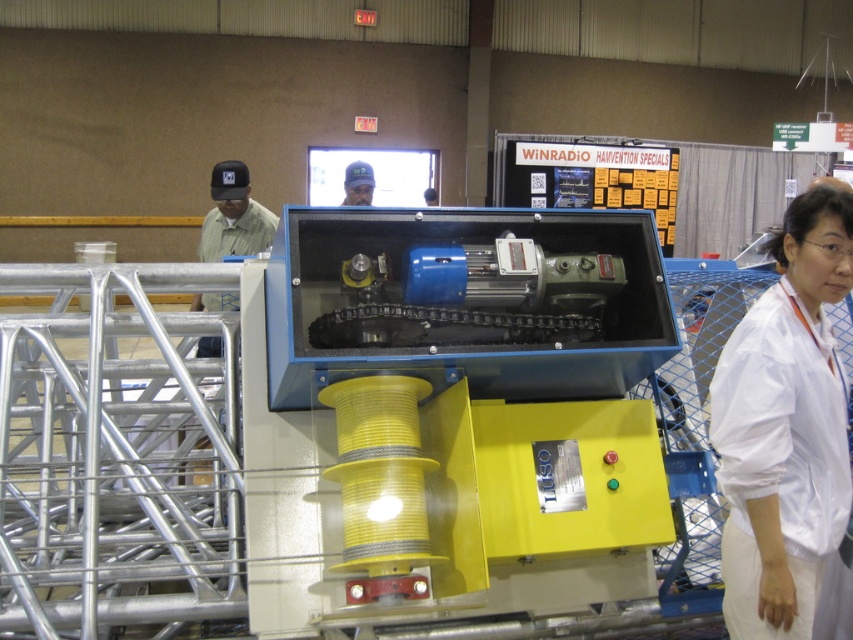
Question: Which object appears closest to the camera in this image?

Choices:
 (A) white fabric at right
 (B) matte green shirt at left
 (C) blue fabric cap at upper center

Answer: (A)

Question: Does white fabric at right appear over matte green shirt at left?

Choices:
 (A) no
 (B) yes

Answer: (A)

Question: Based on their relative distances, which object is nearer to the white fabric at right?

Choices:
 (A) blue fabric cap at upper center
 (B) matte green shirt at left

Answer: (B)

Question: Estimate the real-world distances between objects in this image. Which object is closer to the blue fabric cap at upper center?

Choices:
 (A) matte green shirt at left
 (B) white fabric at right

Answer: (A)

Question: Can you confirm if matte green shirt at left is positioned to the left of blue fabric cap at upper center?

Choices:
 (A) yes
 (B) no

Answer: (A)

Question: In this image, where is matte green shirt at left located relative to blue fabric cap at upper center?

Choices:
 (A) right
 (B) left

Answer: (B)